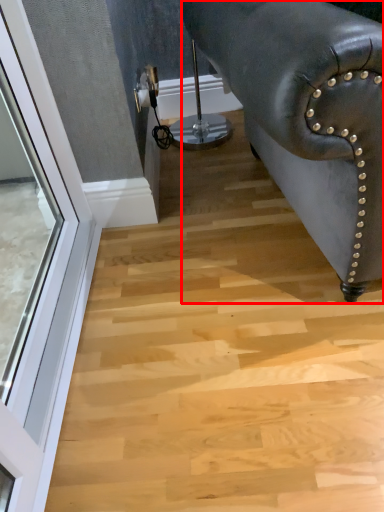
Question: Considering the relative positions of furniture (annotated by the red box) and window in the image provided, where is furniture (annotated by the red box) located with respect to the staircase?

Choices:
 (A) right
 (B) left

Answer: (A)